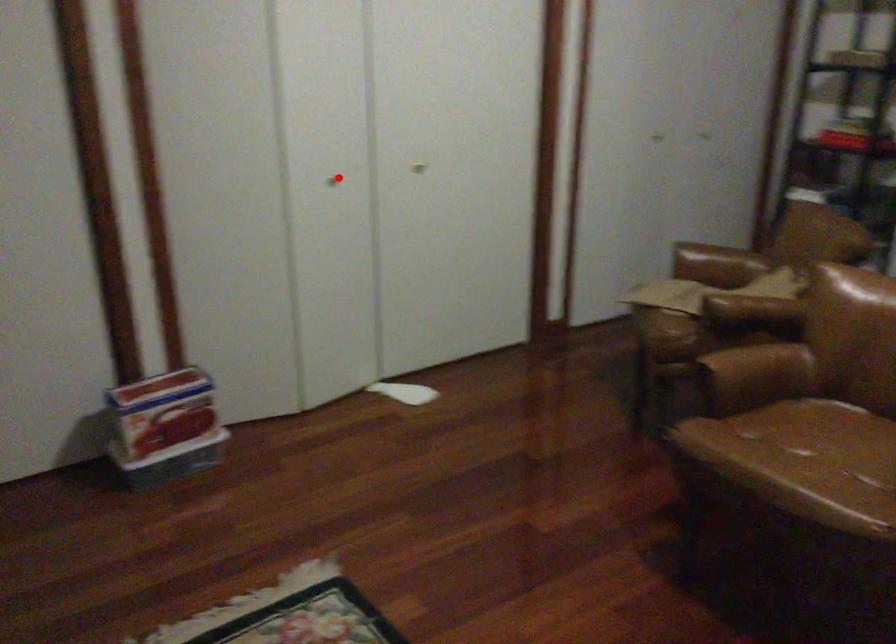
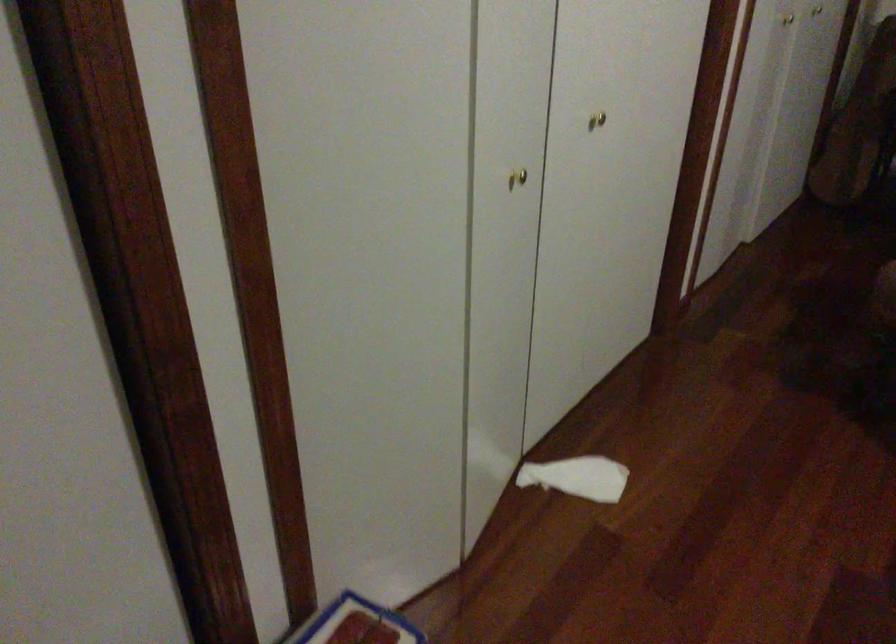
Where in the second image is the point corresponding to the highlighted location from the first image?

(517, 178)